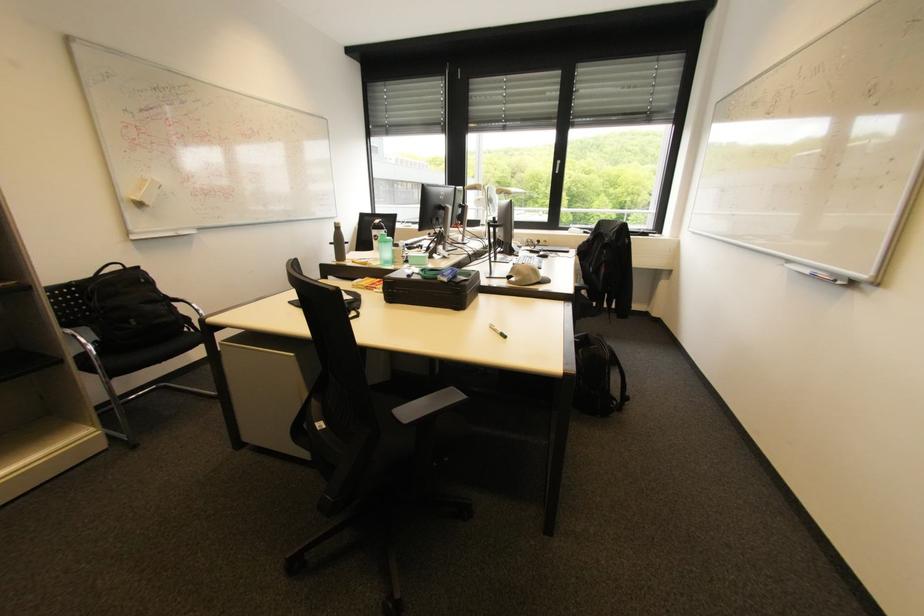
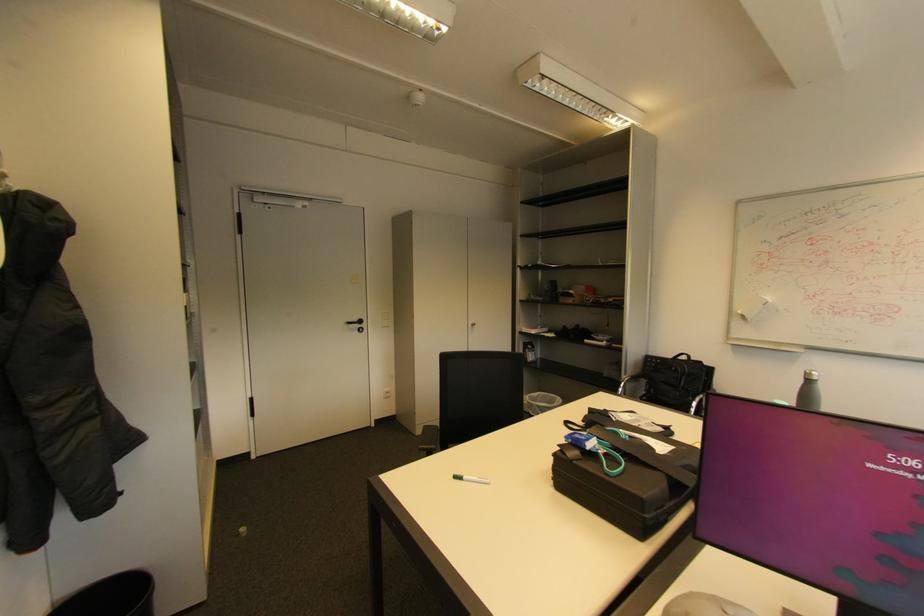
The point at (341, 225) is marked in the first image. Where is the corresponding point in the second image?

(811, 373)